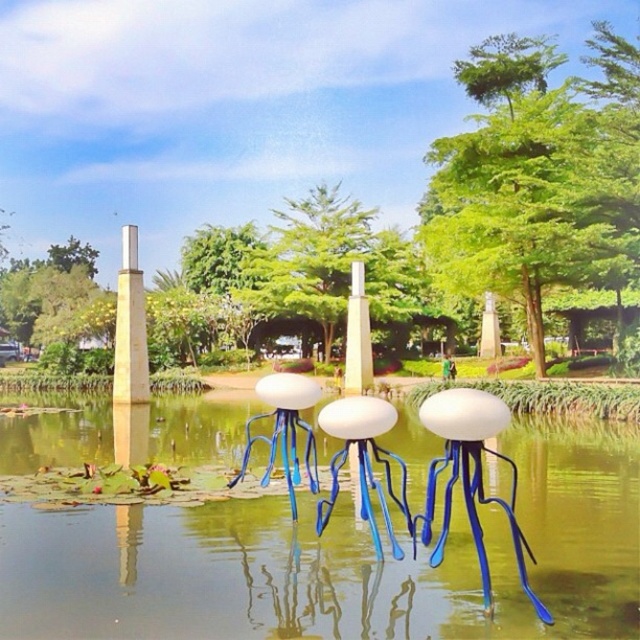
Question: Which of the following is the closest to the observer?

Choices:
 (A) (273, 397)
 (B) (131, 339)

Answer: (A)

Question: Can you confirm if white matte stool at center is bigger than yellow polished stone pillar at center?

Choices:
 (A) yes
 (B) no

Answer: (B)

Question: Which of the following is the farthest from the observer?

Choices:
 (A) matte gold pole at center
 (B) yellow polished stone pillar at center
 (C) translucent glass jellyfish at center

Answer: (A)

Question: Considering the relative positions of white matte stool at center and yellow polished stone pillar at center in the image provided, where is white matte stool at center located with respect to yellow polished stone pillar at center?

Choices:
 (A) right
 (B) left

Answer: (A)

Question: Which is farther from the yellow polished stone pillar at center?

Choices:
 (A) white glossy pillar at center
 (B) matte gold pole at center

Answer: (A)

Question: Is green leafy tree at upper right thinner than matte gold pole at center?

Choices:
 (A) yes
 (B) no

Answer: (B)